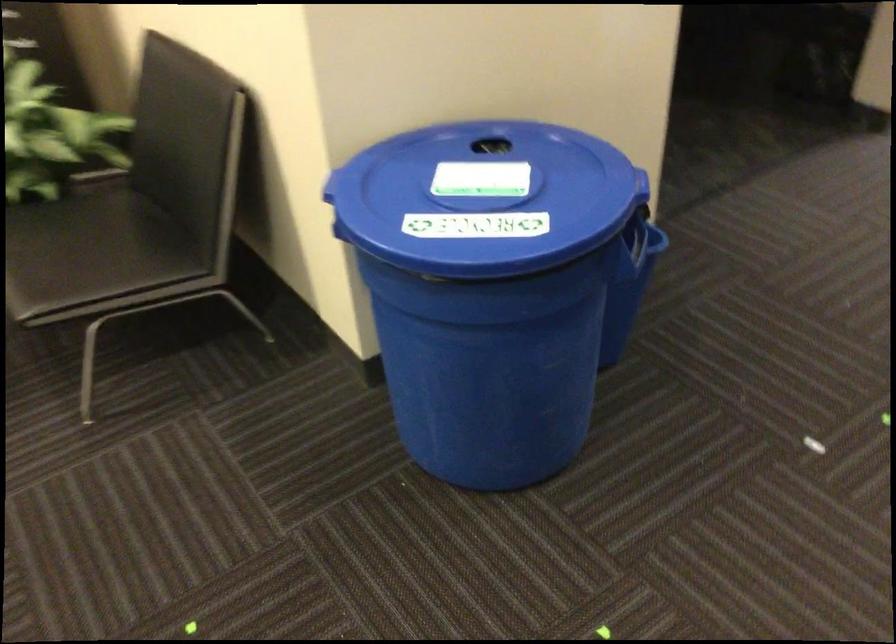
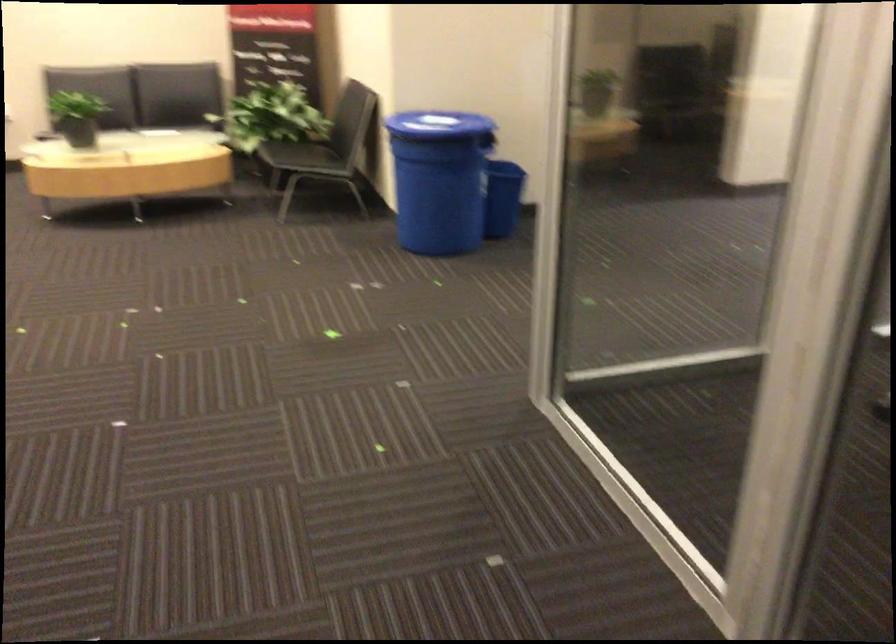
Find the pixel in the second image that matches (x=522, y=234) in the first image.

(438, 124)